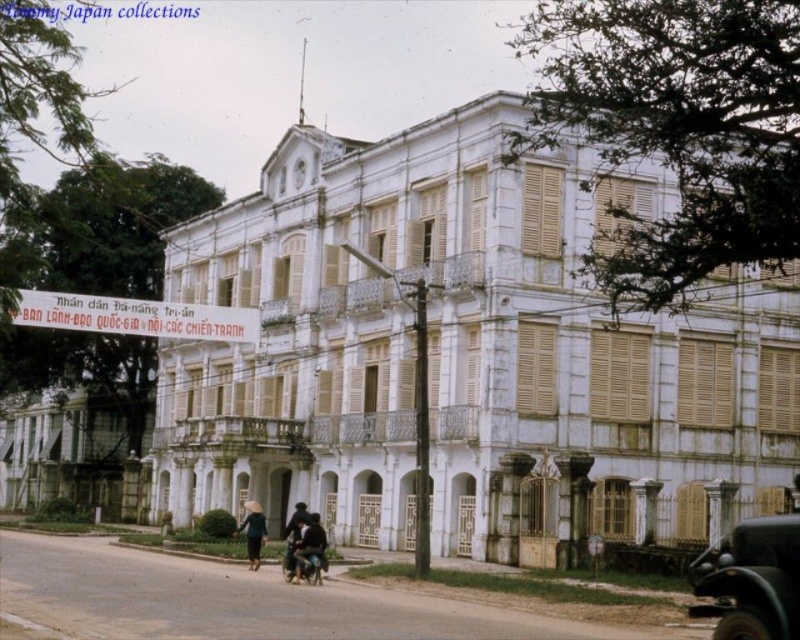
You are a tourist standing on the street in front of the white painted wood palace at lower left and the dark blue fabric jacket at center. Which object is closer to the street level?

The white painted wood palace at lower left is closer to the street level because it is located below the dark blue fabric jacket at center.

You are standing on the sidewalk across from the white painted wood palace at center and the dark blue fabric hat at lower center. Which object is closer to you?

The dark blue fabric hat at lower center is closer to you because the white painted wood palace at center is positioned over it, meaning the hat is in front.